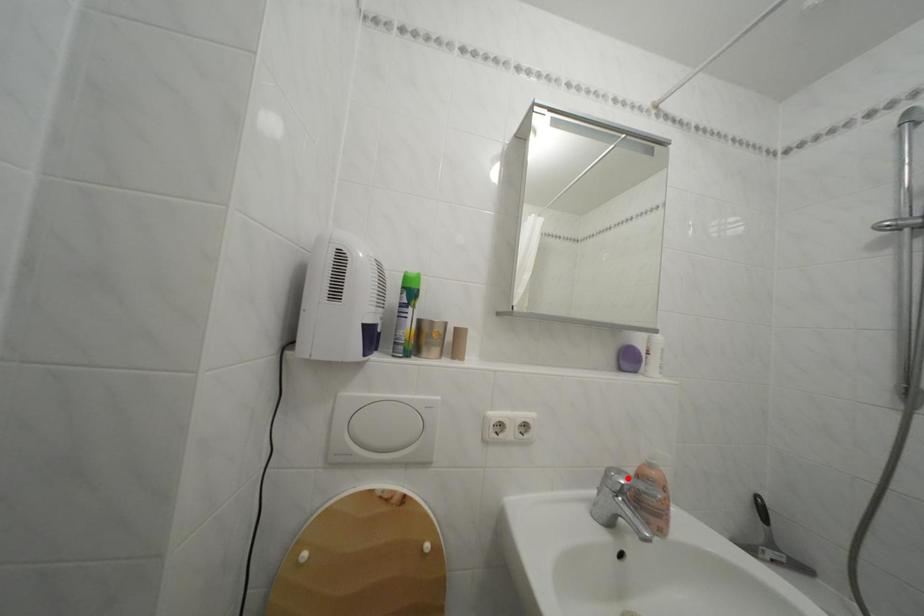
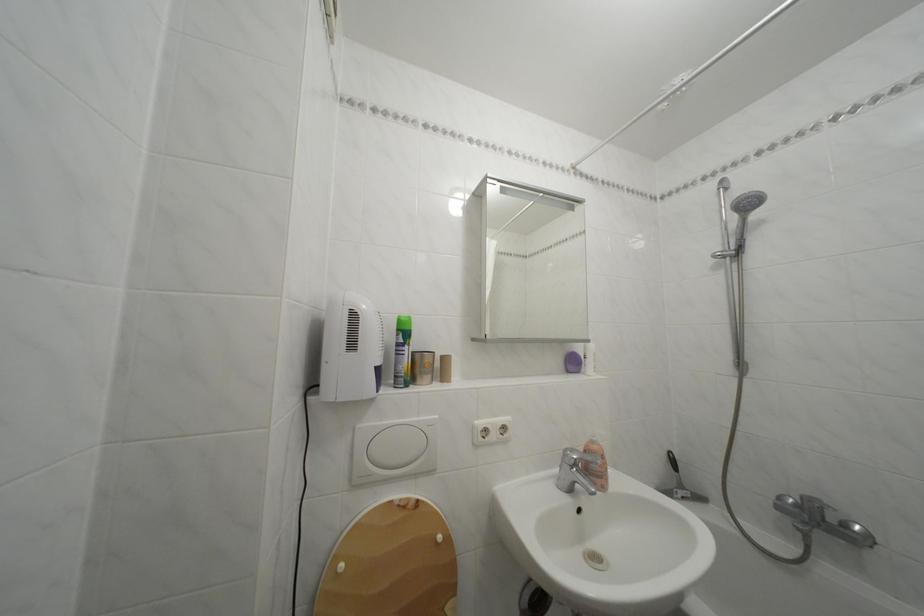
Find the pixel in the second image that matches the highlighted location in the first image.

(581, 456)